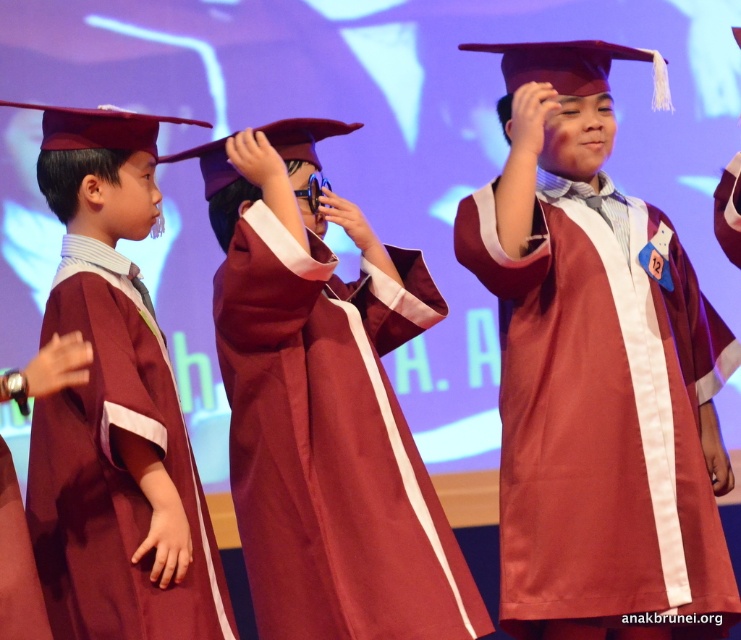
Is maroon matte graduation gown at center shorter than maroon satin graduation gown at center?

No.

Identify the location of maroon matte graduation gown at center. (597, 371).

Is maroon matte graduation gown at center smaller than maroon satin graduation gown at left?

Actually, maroon matte graduation gown at center might be larger than maroon satin graduation gown at left.

Does maroon matte graduation gown at center have a lesser height compared to maroon satin graduation gown at left?

No, maroon matte graduation gown at center is not shorter than maroon satin graduation gown at left.

Which is behind, point (542, 470) or point (144, 388)?

The point (542, 470) is behind.

The image size is (741, 640). I want to click on maroon matte graduation gown at center, so click(x=597, y=371).

Does maroon satin graduation gown at center have a smaller size compared to maroon satin graduation gown at left?

No.

Consider the image. Is maroon satin graduation gown at center thinner than maroon satin graduation gown at left?

In fact, maroon satin graduation gown at center might be wider than maroon satin graduation gown at left.

Is point (262, 284) positioned after point (96, 438)?

Yes, point (262, 284) is farther from viewer.

At what (x,y) coordinates should I click in order to perform the action: click on maroon satin graduation gown at center. Please return your answer as a coordinate pair (x, y). The height and width of the screenshot is (640, 741). Looking at the image, I should click on (325, 404).